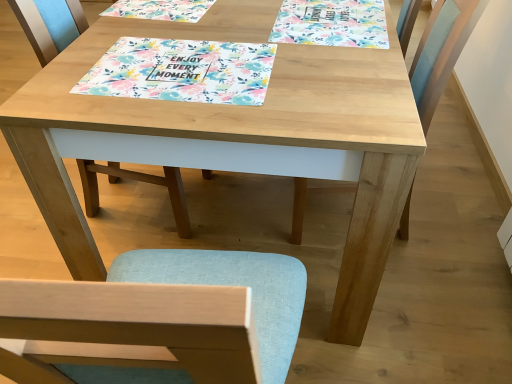
The width and height of the screenshot is (512, 384). In order to click on free area below floral paper placemat at center (from a real-world perspective) in this screenshot , I will do `click(186, 68)`.